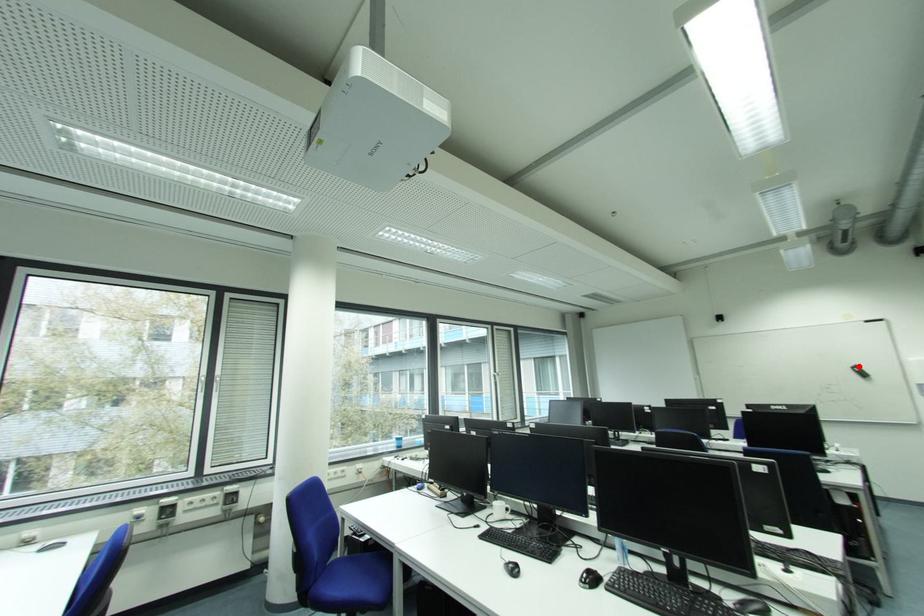
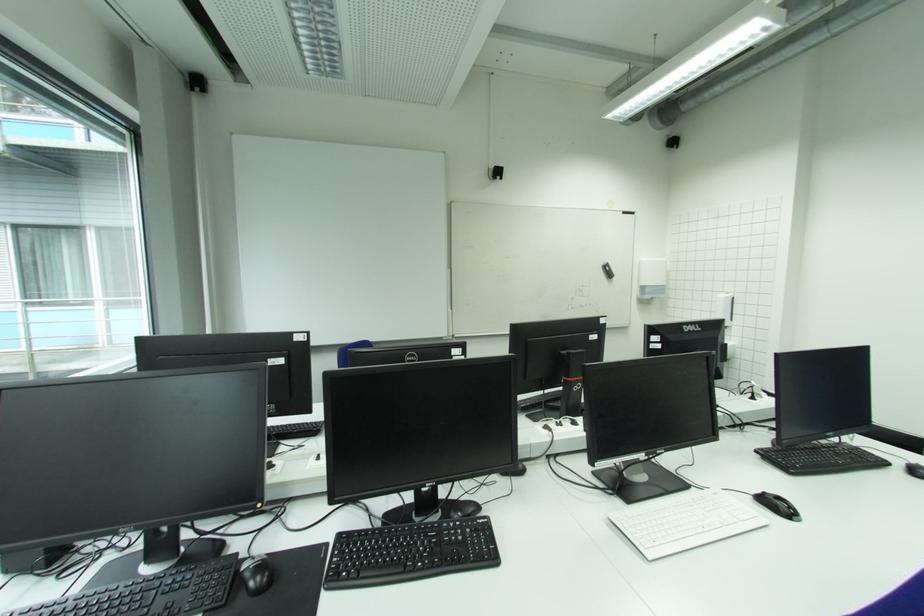
Question: I am providing you with two images of the same scene from different viewpoints. A red point is shown in image1. For the corresponding object point in image2, is it positioned nearer or farther from the camera?

Choices:
 (A) Nearer
 (B) Farther

Answer: (B)